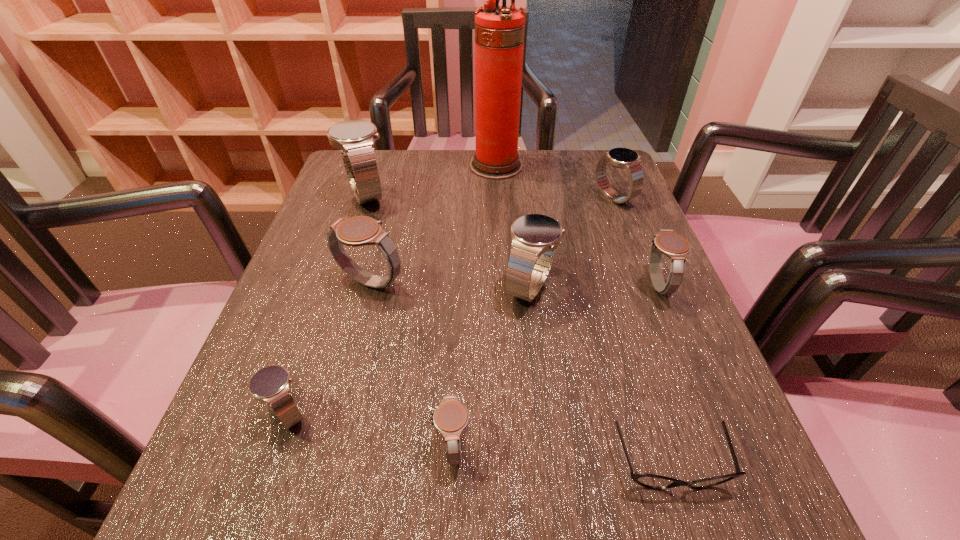
Where is `the tallest object`? The height and width of the screenshot is (540, 960). the tallest object is located at coordinates (499, 29).

This screenshot has height=540, width=960. I want to click on the tallest watch, so point(355,138).

Identify the location of the biggest blue watch. The height and width of the screenshot is (540, 960). (355, 138).

Locate an element on the screen. The height and width of the screenshot is (540, 960). the third blue watch from left to right is located at coordinates (535, 237).

Image resolution: width=960 pixels, height=540 pixels. What are the coordinates of `the third farthest blue watch` in the screenshot? It's located at (535, 237).

Locate an element on the screen. the biggest gray watch is located at coordinates (357, 231).

At what (x,y) coordinates should I click in order to perform the action: click on the rightmost blue watch. Please return your answer as a coordinate pair (x, y). The height and width of the screenshot is (540, 960). Looking at the image, I should click on (624, 158).

Identify the location of the rightmost gray watch. tap(676, 247).

Identify the location of the smallest blue watch. Image resolution: width=960 pixels, height=540 pixels. tap(271, 384).

Image resolution: width=960 pixels, height=540 pixels. I want to click on the nearest gray watch, so click(x=450, y=418).